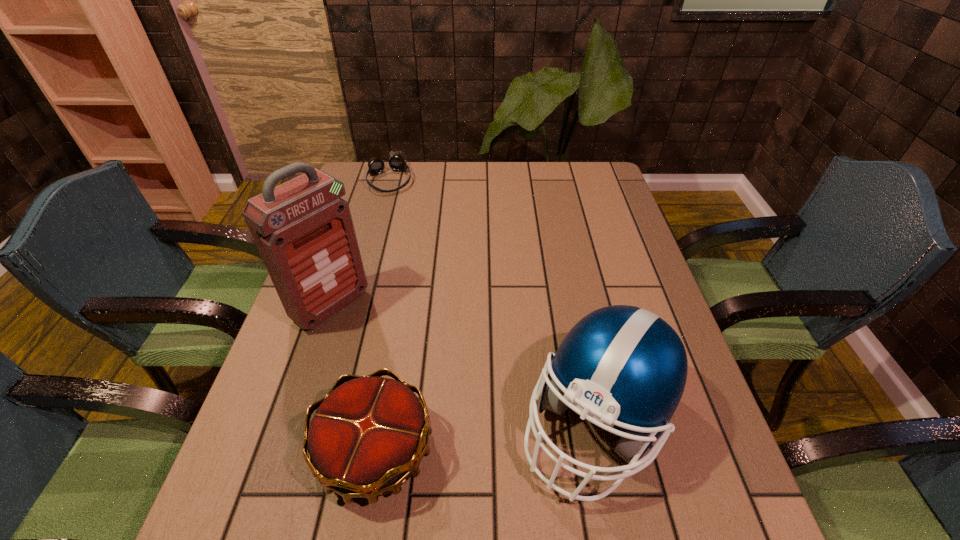
This screenshot has width=960, height=540. Find the location of `object present at the right edge`. object present at the right edge is located at coordinates (623, 366).

Where is `object that is positioned at the far left corner`? object that is positioned at the far left corner is located at coordinates (396, 161).

Where is `object present at the near left corner`? This screenshot has height=540, width=960. object present at the near left corner is located at coordinates (366, 439).

Locate an element on the screen. object situated at the near right corner is located at coordinates (623, 366).

Locate an element on the screen. The width and height of the screenshot is (960, 540). vacant space at the far edge of the desktop is located at coordinates (558, 184).

Find the location of a particular element. The image size is (960, 540). vacant space at the left edge of the desktop is located at coordinates (284, 404).

I want to click on free point at the right edge, so click(x=624, y=217).

This screenshot has width=960, height=540. In the image, there is a desktop. What are the coordinates of `vacant space at the far left corner` in the screenshot? It's located at (359, 183).

This screenshot has width=960, height=540. Find the location of `free space between the second tallest object and the crown`. free space between the second tallest object and the crown is located at coordinates (486, 436).

Where is `free space that is in between the goggles and the crown`? The image size is (960, 540). free space that is in between the goggles and the crown is located at coordinates (382, 315).